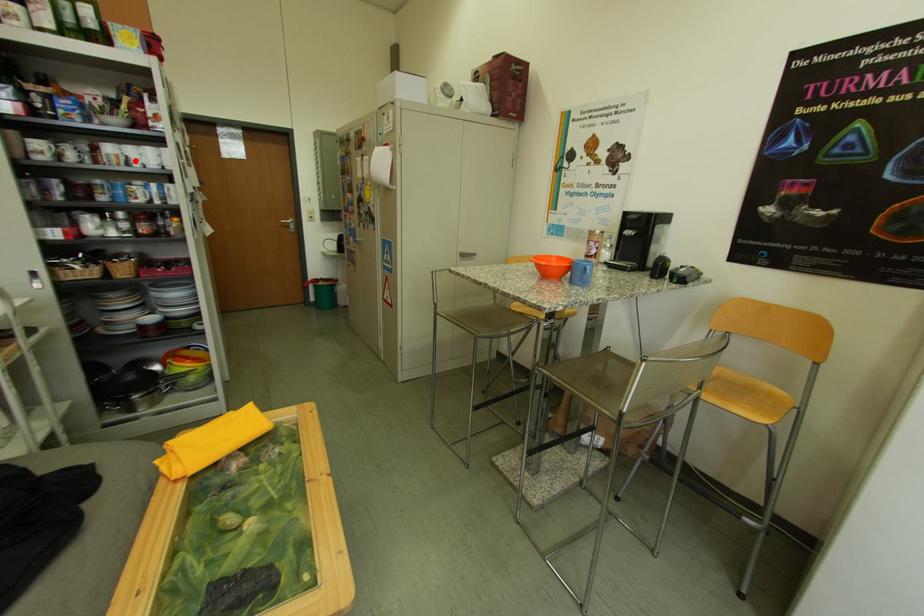
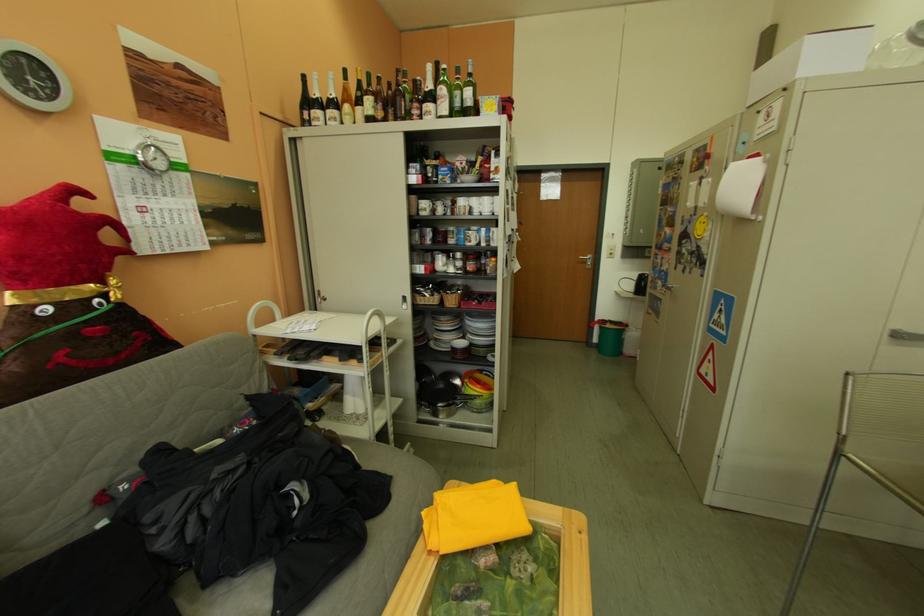
Locate, in the second image, the point that corresponds to the highlighted location in the first image.

(481, 211)